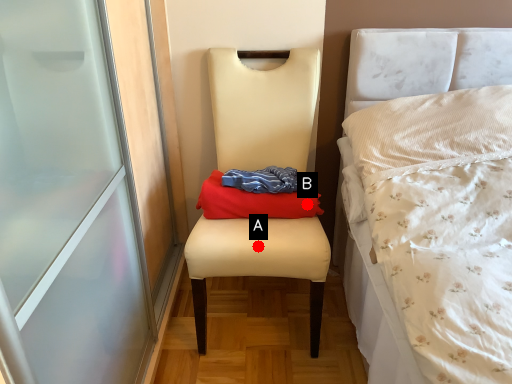
Question: Two points are circled on the image, labeled by A and B beside each circle. Among these points, which one is nearest to the camera?

Choices:
 (A) A is closer
 (B) B is closer

Answer: (A)